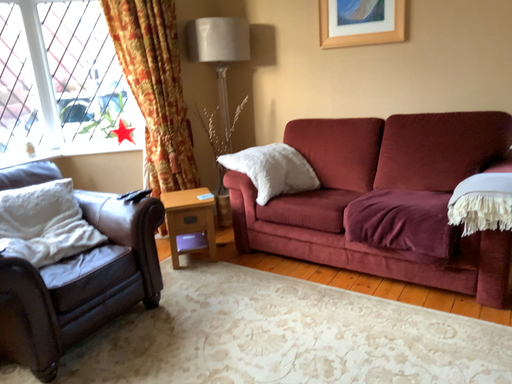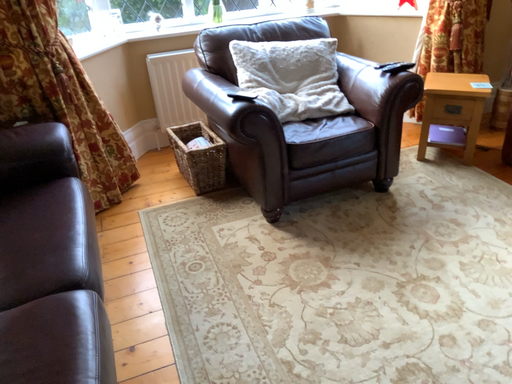
Question: Which way did the camera rotate in the video?

Choices:
 (A) rotated downward
 (B) rotated upward

Answer: (A)